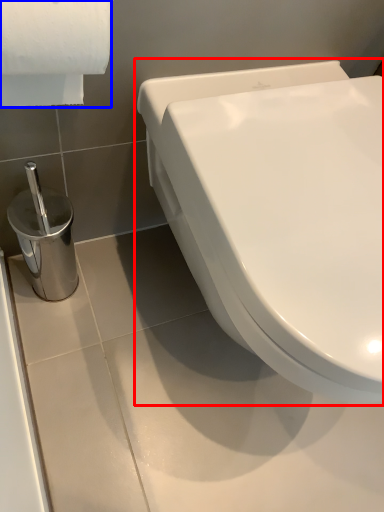
Question: Which of the following is the closest to the observer, toilet (highlighted by a red box) or toilet paper (highlighted by a blue box)?

Choices:
 (A) toilet
 (B) toilet paper

Answer: (B)